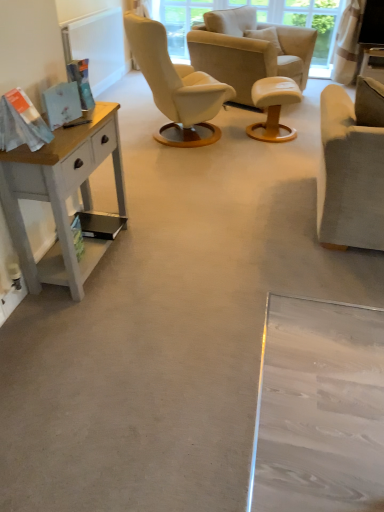
Question: Is suede beige armchair at right, placed as the 2th chair when sorted from back to front, placed right next to white painted wood desk at left?

Choices:
 (A) yes
 (B) no

Answer: (B)

Question: Is there a large distance between suede beige armchair at right, the second chair in the top-to-bottom sequence, and white painted wood desk at left?

Choices:
 (A) no
 (B) yes

Answer: (B)

Question: Can you confirm if suede beige armchair at right, placed as the 2th chair when sorted from back to front, is thinner than white painted wood desk at left?

Choices:
 (A) yes
 (B) no

Answer: (B)

Question: Can you confirm if suede beige armchair at right, placed as the 2th chair when sorted from back to front, is smaller than white painted wood desk at left?

Choices:
 (A) yes
 (B) no

Answer: (B)

Question: Can we say suede beige armchair at right, the second chair in the top-to-bottom sequence, lies outside white painted wood desk at left?

Choices:
 (A) yes
 (B) no

Answer: (A)

Question: Considering the relative sizes of suede beige armchair at right, the second chair in the top-to-bottom sequence, and white painted wood desk at left in the image provided, is suede beige armchair at right, the second chair in the top-to-bottom sequence, wider than white painted wood desk at left?

Choices:
 (A) yes
 (B) no

Answer: (A)

Question: Is white leather stool at center completely or partially outside of white painted wood desk at left?

Choices:
 (A) no
 (B) yes

Answer: (B)

Question: Is white leather stool at center smaller than white painted wood desk at left?

Choices:
 (A) no
 (B) yes

Answer: (B)

Question: Considering the relative sizes of white leather stool at center and white painted wood desk at left in the image provided, is white leather stool at center wider than white painted wood desk at left?

Choices:
 (A) no
 (B) yes

Answer: (B)

Question: Is the position of white leather stool at center less distant than that of white painted wood desk at left?

Choices:
 (A) yes
 (B) no

Answer: (B)

Question: Considering the relative sizes of white leather stool at center and white painted wood desk at left in the image provided, is white leather stool at center thinner than white painted wood desk at left?

Choices:
 (A) yes
 (B) no

Answer: (B)

Question: Would you consider white leather stool at center to be distant from white painted wood desk at left?

Choices:
 (A) no
 (B) yes

Answer: (B)

Question: Can you confirm if suede beige armchair at right, the first chair viewed from the front, is positioned to the left of suede beige armchair at center, the first chair when ordered from top to bottom?

Choices:
 (A) no
 (B) yes

Answer: (A)